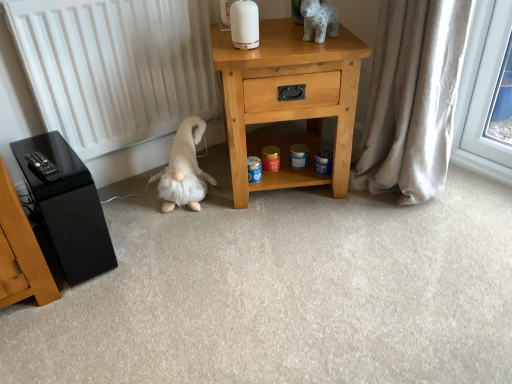
The image size is (512, 384). Identify the location of free space that is in between beige fabric curtain at right and black glossy speaker at left. (232, 230).